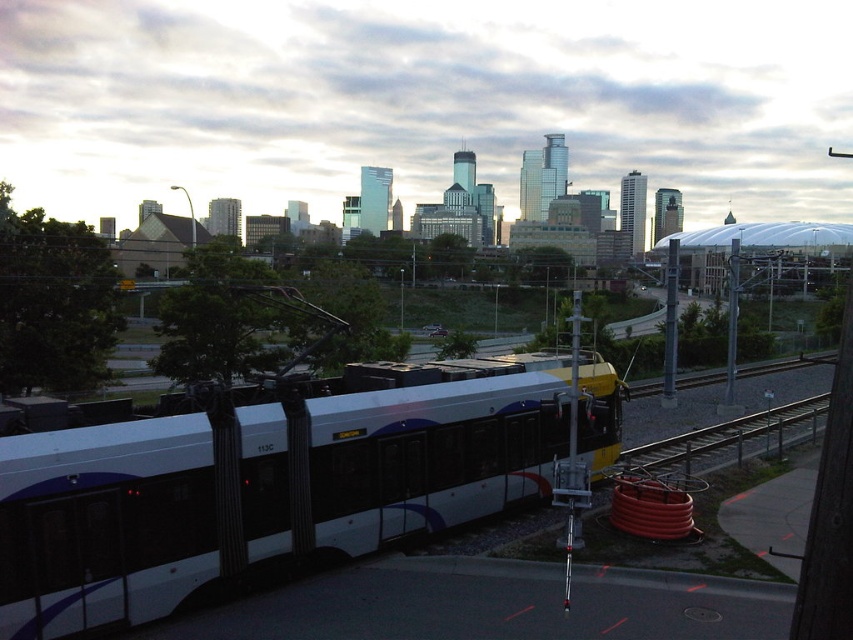
Question: Among these points, which one is nearest to the camera?

Choices:
 (A) (244, 392)
 (B) (663, 442)

Answer: (A)

Question: Is white glossy passenger train at center positioned in front of metallic gray train track at lower right?

Choices:
 (A) no
 (B) yes

Answer: (B)

Question: Is white glossy passenger train at center thinner than metallic gray train track at lower right?

Choices:
 (A) no
 (B) yes

Answer: (B)

Question: Is white glossy passenger train at center above metallic gray train track at lower right?

Choices:
 (A) no
 (B) yes

Answer: (B)